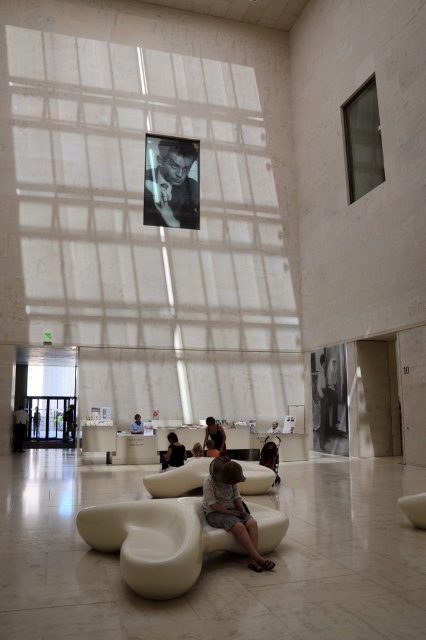
Between dark gray fabric couch at center and light brown wooden chair at center, which one has more height?

dark gray fabric couch at center is taller.

Is dark gray fabric couch at center further to camera compared to light brown wooden chair at center?

Yes, it is behind light brown wooden chair at center.

Is point (20, 404) positioned in front of point (141, 422)?

No, it is behind (141, 422).

Locate an element on the screen. This screenshot has height=640, width=426. dark gray fabric couch at center is located at coordinates (19, 428).

Can you confirm if matte beige couch at center is thinner than dark gray fabric chair at center?

In fact, matte beige couch at center might be wider than dark gray fabric chair at center.

Who is more forward, (x=233, y=464) or (x=34, y=417)?

Point (x=233, y=464)

You are a GUI agent. You are given a task and a screenshot of the screen. Output one action in this format:
    pyautogui.click(x=<x>, y=<y>)
    Task: Click on the matte beige couch at center
    Image resolution: width=426 pixels, height=640 pixels.
    Given the screenshot: What is the action you would take?
    pyautogui.click(x=232, y=508)

Is black and white photograph of a man at upper center positioned behind dark gray fabric jacket at center?

That is True.

Between black and white photograph of a man at upper center and dark gray fabric jacket at center, which one is positioned lower?

dark gray fabric jacket at center

Between point (147, 140) and point (172, 440), which one is positioned behind?

The point (147, 140) is behind.

Locate an element on the screen. black and white photograph of a man at upper center is located at coordinates (172, 180).